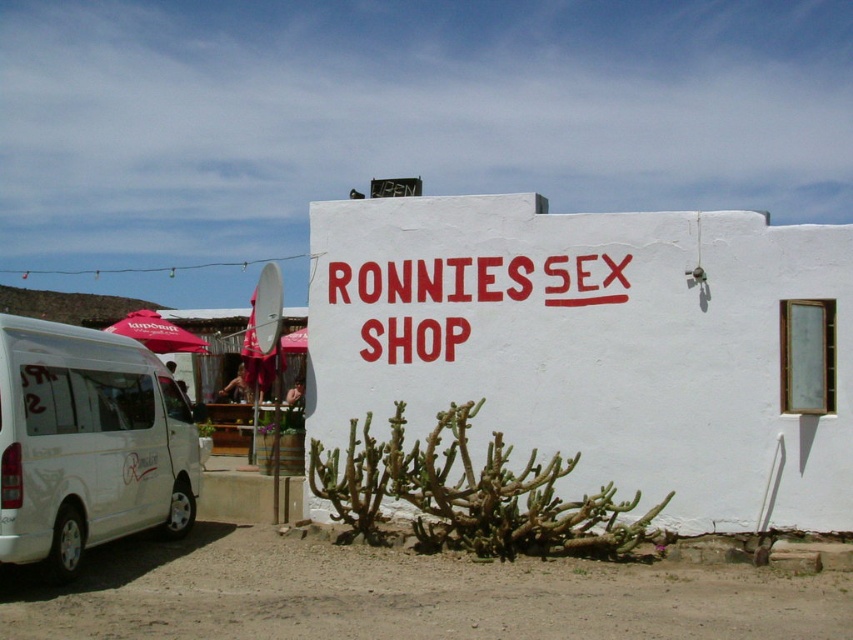
Based on the photo, which is more to the left, white matte van at lower left or red fabric umbrella at center?

white matte van at lower left is more to the left.

Is white matte van at lower left smaller than red fabric umbrella at center?

No, white matte van at lower left is not smaller than red fabric umbrella at center.

Who is more distant from viewer, (50, 404) or (289, 348)?

The point (289, 348) is more distant.

Where is `white matte van at lower left`? Image resolution: width=853 pixels, height=640 pixels. white matte van at lower left is located at coordinates (86, 444).

Does white matte van at lower left have a greater width compared to red fabric umbrella at left?

No, white matte van at lower left is not wider than red fabric umbrella at left.

Can you confirm if white matte van at lower left is positioned to the right of red fabric umbrella at left?

Indeed, white matte van at lower left is positioned on the right side of red fabric umbrella at left.

The width and height of the screenshot is (853, 640). What do you see at coordinates (86, 444) in the screenshot? I see `white matte van at lower left` at bounding box center [86, 444].

I want to click on white matte van at lower left, so [86, 444].

Can you confirm if red matte sign at center is positioned to the left of red fabric umbrella at center?

In fact, red matte sign at center is to the right of red fabric umbrella at center.

Based on the photo, is red matte sign at center further to the viewer compared to red fabric umbrella at center?

That is False.

Locate an element on the screen. red matte sign at center is located at coordinates click(482, 280).